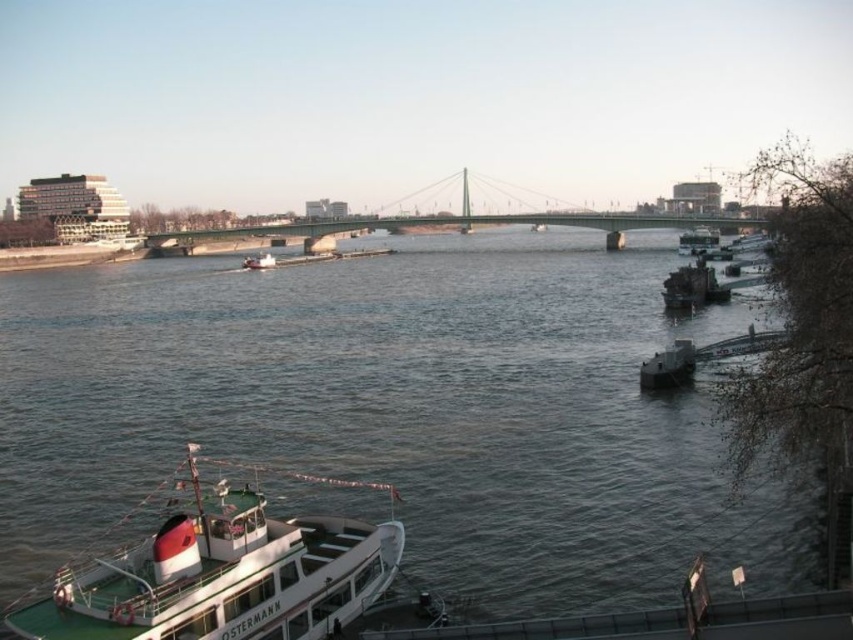
Does metallic gray barge at center-right appear on the right side of white matte boat at center?

Correct, you'll find metallic gray barge at center-right to the right of white matte boat at center.

Between metallic gray barge at center-right and white matte boat at center, which one is positioned lower?

metallic gray barge at center-right

Which is behind, point (677, 298) or point (259, 268)?

Point (259, 268)

Locate an element on the screen. Image resolution: width=853 pixels, height=640 pixels. metallic gray barge at center-right is located at coordinates (692, 288).

Is smooth water at center wider than white matte boat at center?

Correct, the width of smooth water at center exceeds that of white matte boat at center.

This screenshot has width=853, height=640. I want to click on smooth water at center, so click(x=396, y=410).

Does dark gray metallic boat at lower right appear under white matte boat at center?

Indeed, dark gray metallic boat at lower right is positioned under white matte boat at center.

Is point (671, 349) farther from camera compared to point (262, 266)?

No, (671, 349) is closer to viewer.

What do you see at coordinates (668, 365) in the screenshot?
I see `dark gray metallic boat at lower right` at bounding box center [668, 365].

Where is `dark gray metallic boat at lower right`? The width and height of the screenshot is (853, 640). dark gray metallic boat at lower right is located at coordinates (668, 365).